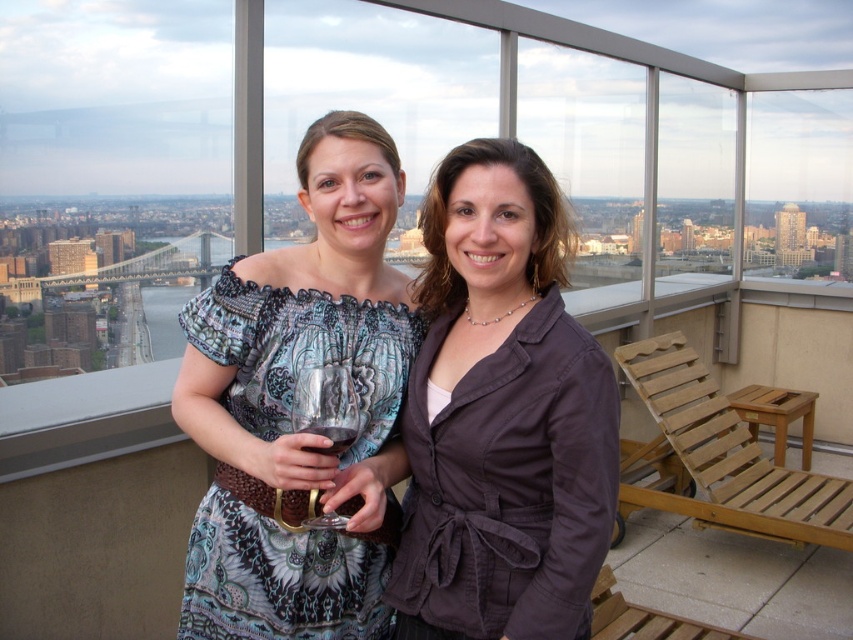
Looking at this image, you are standing on the rooftop terrace and want to take a photo of the city view through the translucent glass at center while also including the matte brown blazer at center in the frame. Which side of the glass should you position yourself to capture both elements?

You should position yourself to the left of the translucent glass at center. Since the matte brown blazer at center is to the right of the glass, standing on the left side allows you to include both the city view through the glass and the blazer in the frame.

Consider the image. You are standing on the rooftop terrace and want to hand your drink to the person wearing the matte brown blazer at center without crossing the translucent glass at center. Can you do this while staying on the terrace?

The matte brown blazer at center is 20.22 meters away from the translucent glass at center. Since the distance between them is significant, you can safely hand your drink to the person without crossing the glass as long as you stay within the terrace area.